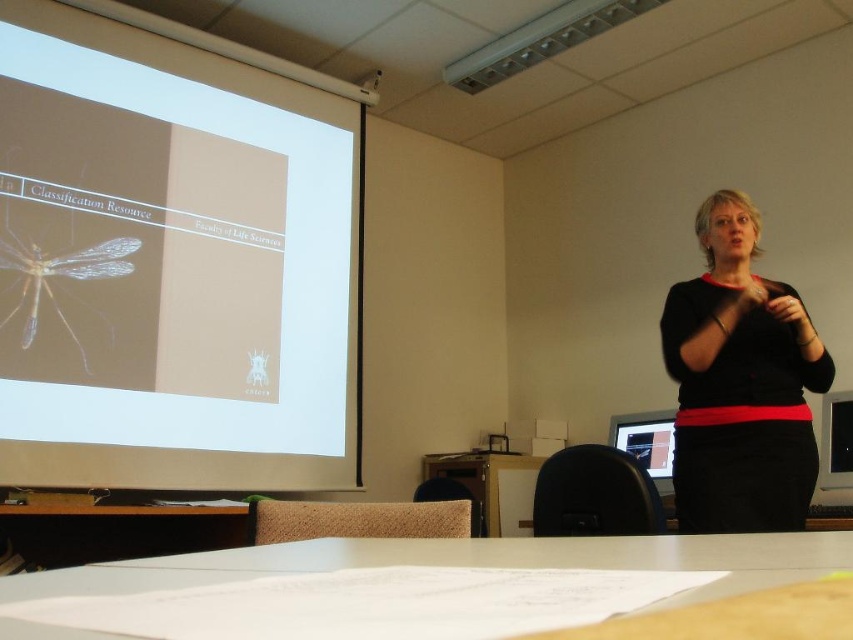
Question: Which point appears closest to the camera in this image?

Choices:
 (A) (740, 212)
 (B) (142, 448)

Answer: (A)

Question: Does black matte sweater at upper right appear on the right side of translucent yellowishmaterial/texture mosquito at upper left?

Choices:
 (A) no
 (B) yes

Answer: (B)

Question: Which object is positioned farthest from the white glossy projection screen at upper left?

Choices:
 (A) black matte sweater at upper right
 (B) translucent yellowishmaterial/texture mosquito at upper left

Answer: (A)

Question: Is black matte sweater at upper right below translucent yellowishmaterial/texture mosquito at upper left?

Choices:
 (A) yes
 (B) no

Answer: (A)

Question: Does black matte sweater at upper right have a smaller size compared to translucent yellowishmaterial/texture mosquito at upper left?

Choices:
 (A) no
 (B) yes

Answer: (A)

Question: Among these points, which one is farthest from the camera?

Choices:
 (A) (91, 355)
 (B) (753, 353)

Answer: (A)